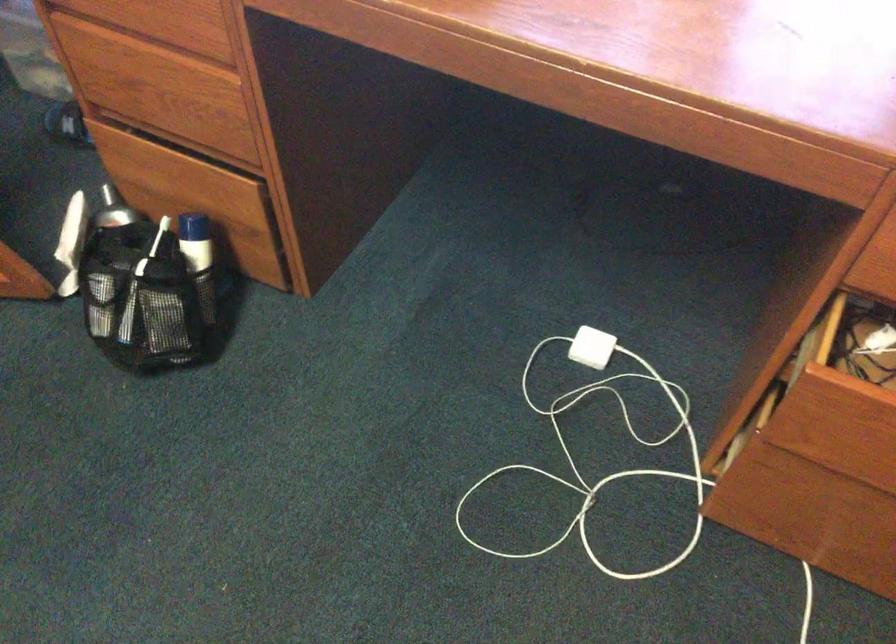
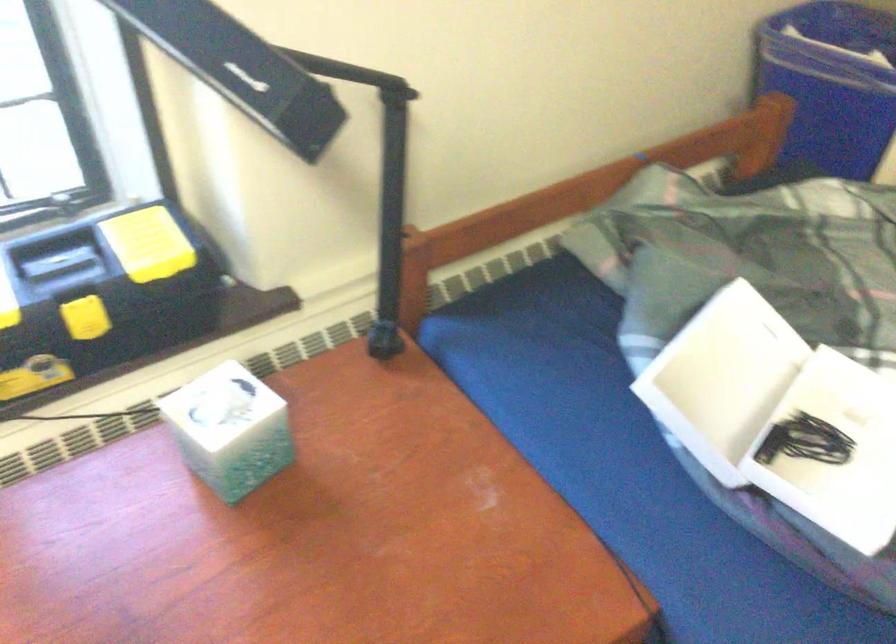
Question: Based on the continuous images, in which direction is the camera rotating? Reply with the corresponding letter.

Choices:
 (A) Left
 (B) Right
 (C) Up
 (D) Down

Answer: (B)